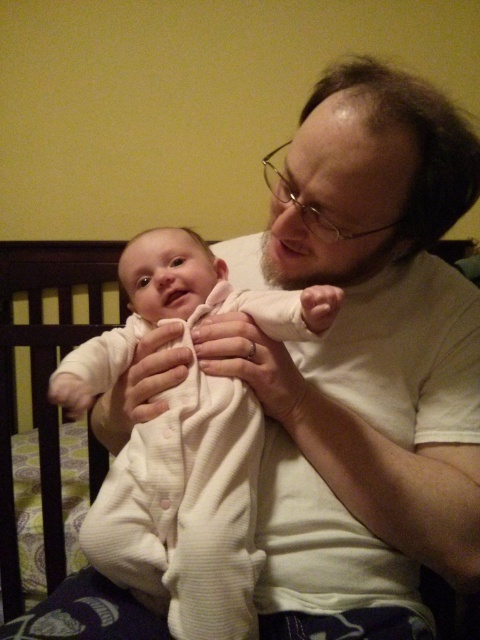
Question: Is white ribbed onesie at center bigger than white soft fabric at center?

Choices:
 (A) no
 (B) yes

Answer: (B)

Question: Is white ribbed onesie at center below white soft fabric at center?

Choices:
 (A) yes
 (B) no

Answer: (B)

Question: Considering the relative positions of white ribbed onesie at center and white soft fabric at center in the image provided, where is white ribbed onesie at center located with respect to white soft fabric at center?

Choices:
 (A) below
 (B) above

Answer: (B)

Question: Which of the following is the farthest from the observer?

Choices:
 (A) white soft fabric at center
 (B) white ribbed onesie at center

Answer: (A)